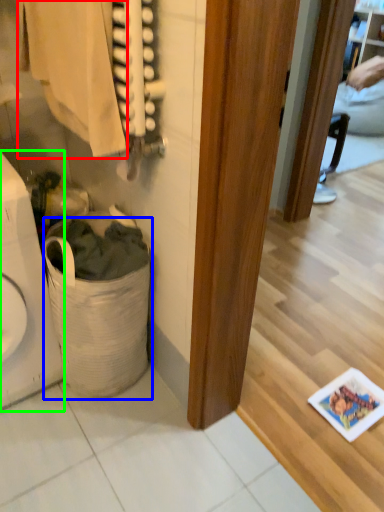
Question: Based on their relative distances, which object is farther from clothing (highlighted by a red box)? Choose from laundry basket (highlighted by a blue box) and appliance (highlighted by a green box).

Choices:
 (A) laundry basket
 (B) appliance

Answer: (A)